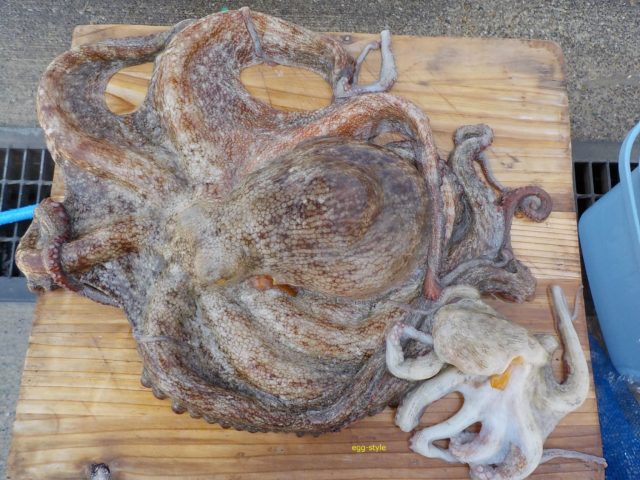
In order to click on knot in wood in this screenshot , I will do `click(98, 469)`.